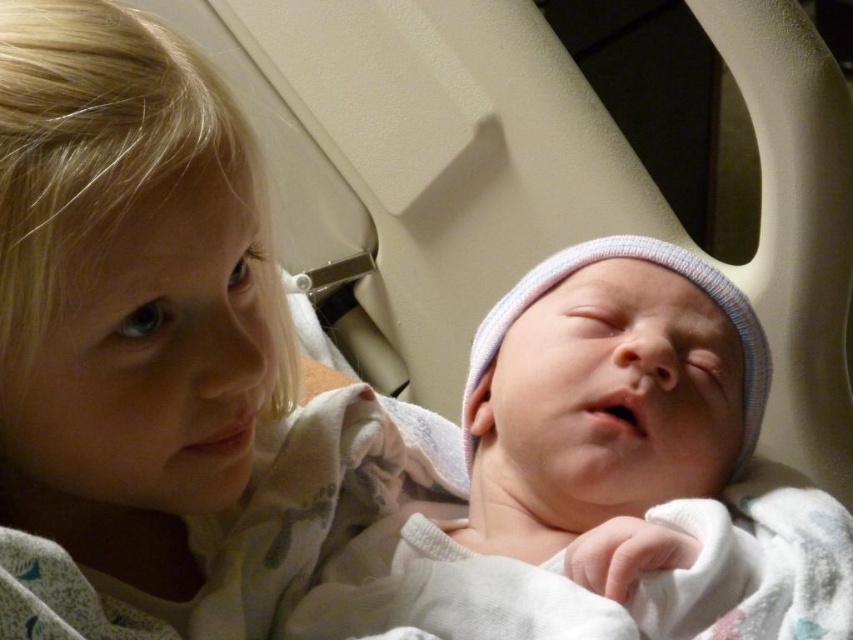
You are a photographer setting up for a family portrait. You notice the smooth white blanket at upper left and the white soft hat at center in the scene. Based on their positions, which object would be more likely to be in the background of the photo?

The smooth white blanket at upper left is located above the white soft hat at center, so it would be more likely to be in the background of the photo since it is positioned higher up.

You are a photographer setting up for a family portrait. You need to ensure that the smooth white blanket at upper left and the white soft hat at center are visible in the frame. Given their current positions, can you confirm if there is enough space between them to capture both clearly?

The smooth white blanket at upper left is 6.00 inches from the white soft hat at center, so there is sufficient space between them to capture both clearly in the frame.

You are a photographer trying to capture a closeup of the white soft hat at center without the smooth white blanket at upper left blocking the view. Can you move to the right side of the blanket to get a clear shot?

The smooth white blanket at upper left is positioned on the left side of the white soft hat at center, so moving to the right side of the blanket would allow you to capture the white soft hat at center without obstruction.